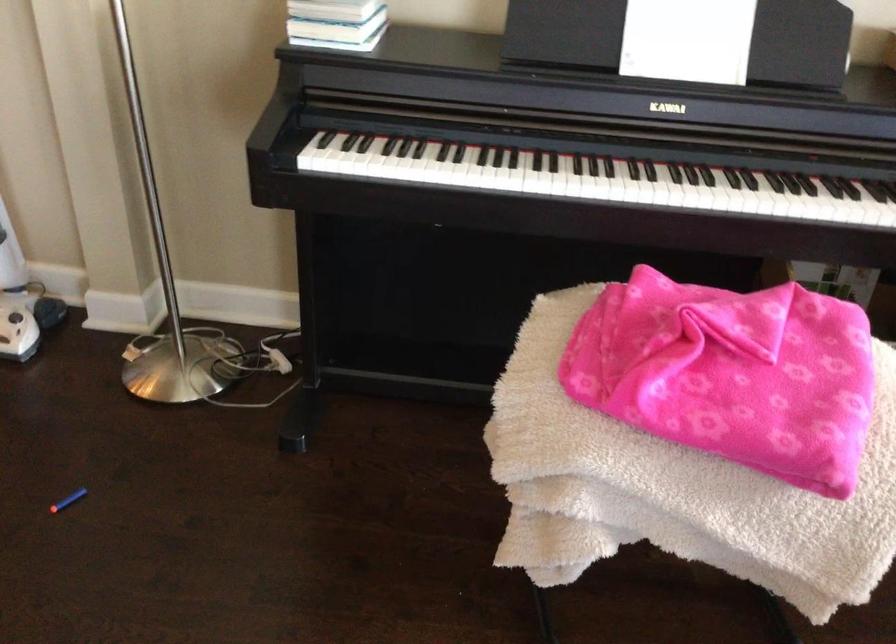
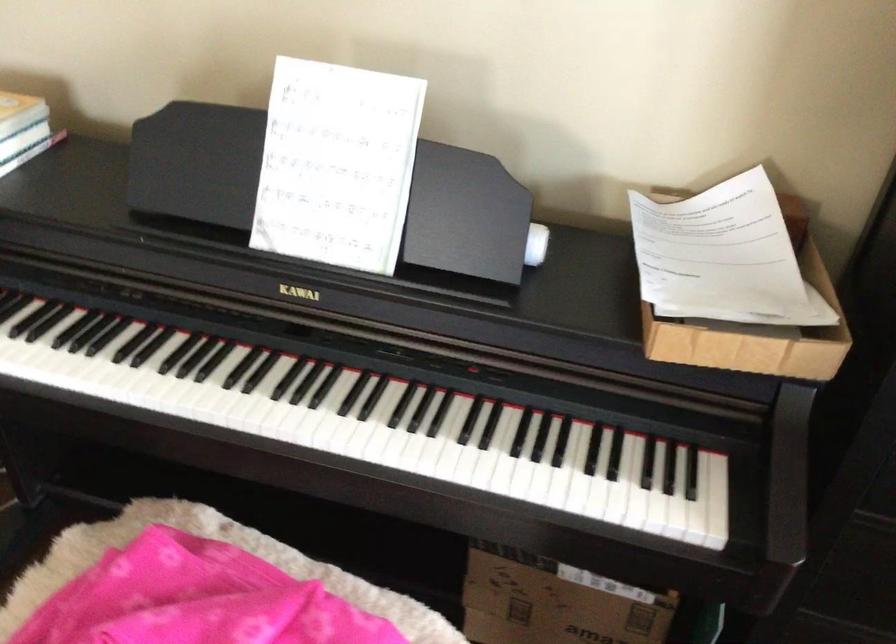
Find the pixel in the second image that matches (x=607, y=178) in the first image.

(177, 397)